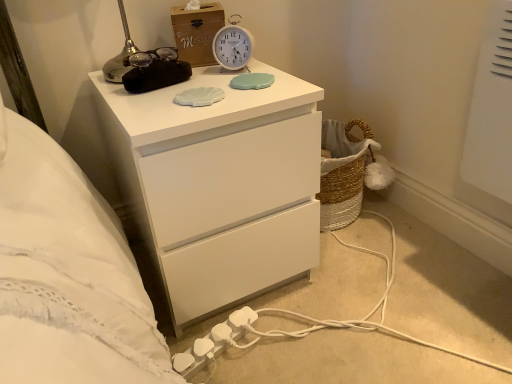
Locate an element on the screen. The width and height of the screenshot is (512, 384). vacant area in front of woodenmaterial/texturebox at upper center is located at coordinates (209, 87).